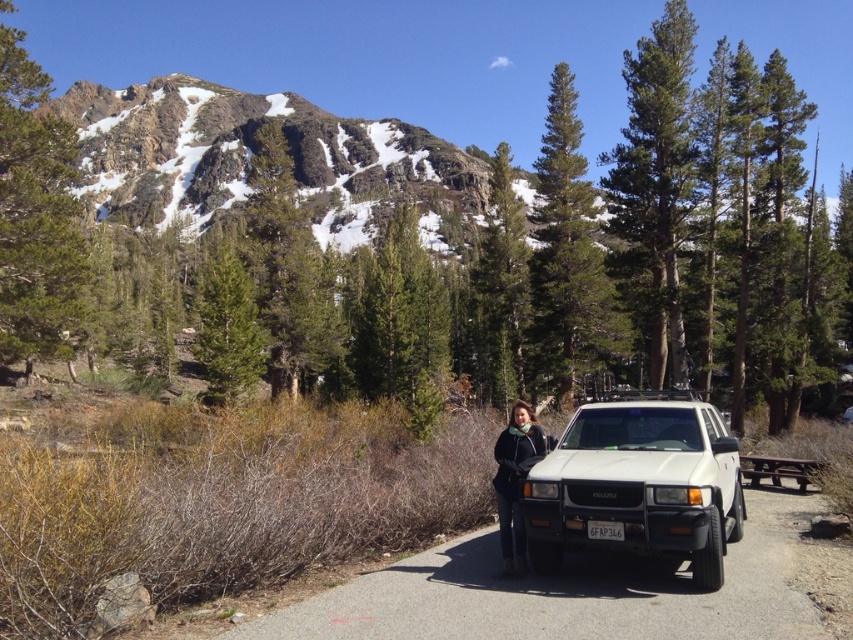
Between white matte jeep at center and dark blue jacket at center, which one is positioned lower?

Positioned lower is dark blue jacket at center.

Between point (698, 516) and point (515, 401), which one is positioned in front?

Point (698, 516) is in front.

Locate an element on the screen. The width and height of the screenshot is (853, 640). white matte jeep at center is located at coordinates (639, 484).

Which of these two, dark blue jacket at center or white plastic license plate at center, stands taller?

dark blue jacket at center is taller.

Consider the image. Does dark blue jacket at center appear on the right side of white plastic license plate at center?

No, dark blue jacket at center is not to the right of white plastic license plate at center.

Who is more forward, (x=508, y=525) or (x=607, y=524)?

Point (x=607, y=524) is more forward.

The image size is (853, 640). What are the coordinates of `dark blue jacket at center` in the screenshot? It's located at (515, 480).

Who is more forward, (717, 516) or (598, 522)?

Point (717, 516)

Is point (726, 493) behind point (589, 528)?

Yes.

The width and height of the screenshot is (853, 640). In order to click on white matte jeep at center in this screenshot , I will do `click(639, 484)`.

Find the location of a particular element. The width and height of the screenshot is (853, 640). white matte jeep at center is located at coordinates (639, 484).